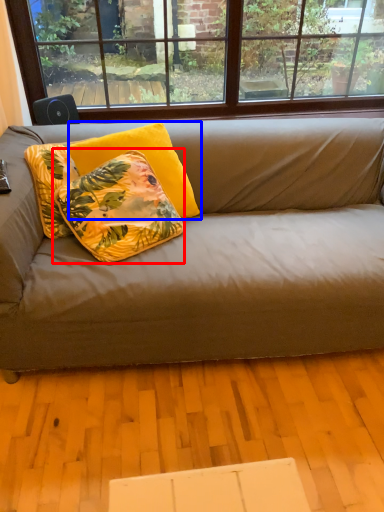
Question: Among these objects, which one is farthest to the camera, pillow (highlighted by a red box) or pillow (highlighted by a blue box)?

Choices:
 (A) pillow
 (B) pillow

Answer: (B)